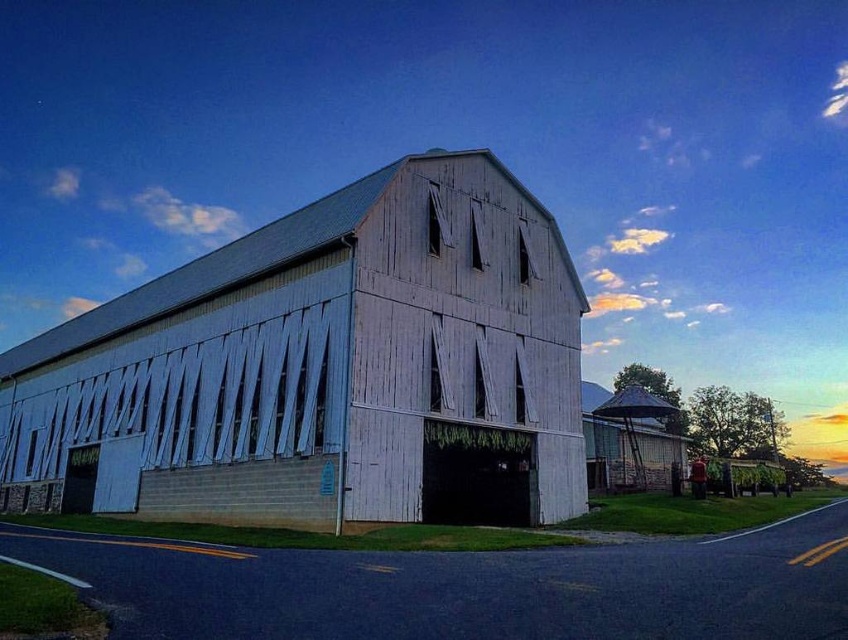
You are driving along the road and see the white wood barn at center and the rustic wood silo at right. Which structure is closer to the road?

The white wood barn at center is closer to the road because it is positioned on the left side of the rustic wood silo at right, which is further away.

You are a painter planning to paint the white wood barn at center and the rustic wood silo at right. If you want to paint the taller structure first, which one should you start with?

The white wood barn at center is taller than the rustic wood silo at right, so you should start by painting the white wood barn at center first.